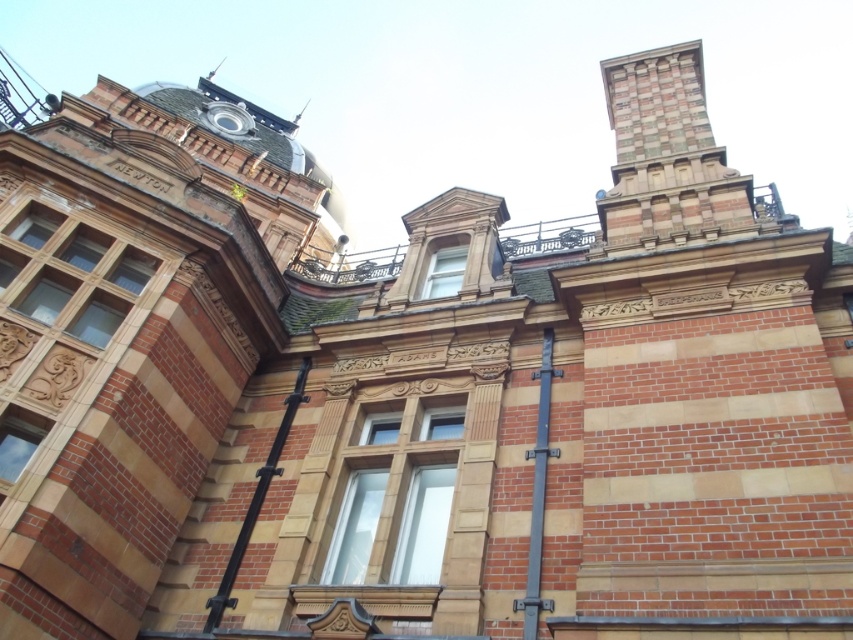
What do you see at coordinates (397, 499) in the screenshot?
I see `matte glass window at center` at bounding box center [397, 499].

Measure the distance between matte glass window at center and camera.

matte glass window at center and camera are 37.29 meters apart.

Find the location of a particular element. matte glass window at center is located at coordinates 397,499.

This screenshot has height=640, width=853. In order to click on matte glass window at center in this screenshot , I will do `click(397, 499)`.

Which is above, black metal pole at lower left or clear glass window at lower left?

clear glass window at lower left is above.

Is point (233, 577) in front of point (39, 426)?

No, (233, 577) is further to viewer.

At what (x,y) coordinates should I click in order to perform the action: click on black metal pole at lower left. Please return your answer as a coordinate pair (x, y). This screenshot has width=853, height=640. Looking at the image, I should click on (256, 502).

At what (x,y) coordinates should I click in order to perform the action: click on brown wooden window at upper left. Please return your answer as a coordinate pair (x, y). The height and width of the screenshot is (640, 853). Looking at the image, I should click on (67, 278).

Can you confirm if brown wooden window at upper left is positioned below clear glass window at upper center?

Yes.

This screenshot has width=853, height=640. Describe the element at coordinates (67, 278) in the screenshot. I see `brown wooden window at upper left` at that location.

Image resolution: width=853 pixels, height=640 pixels. What are the coordinates of `brown wooden window at upper left` in the screenshot? It's located at (67, 278).